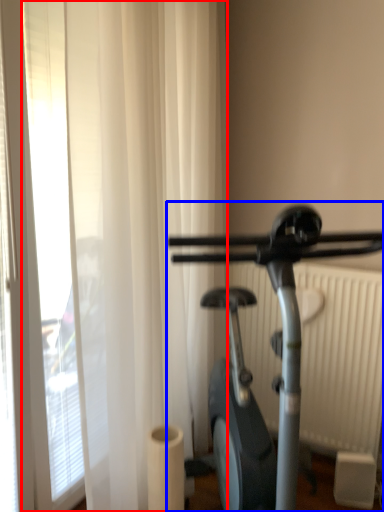
Question: Which of the following is the farthest to the observer, shower curtain (highlighted by a red box) or stationary bicycle (highlighted by a blue box)?

Choices:
 (A) shower curtain
 (B) stationary bicycle

Answer: (A)